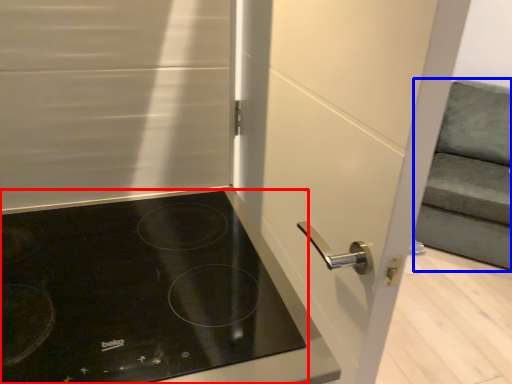
Question: Which object appears closest to the camera in this image, gas stove (highlighted by a red box) or armchair (highlighted by a blue box)?

Choices:
 (A) gas stove
 (B) armchair

Answer: (A)